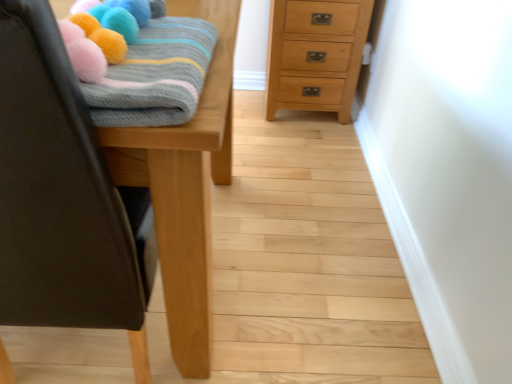
The height and width of the screenshot is (384, 512). Find the location of `free space above knitted woolen blanket at upper left (from a real-world perspective)`. free space above knitted woolen blanket at upper left (from a real-world perspective) is located at coordinates (151, 51).